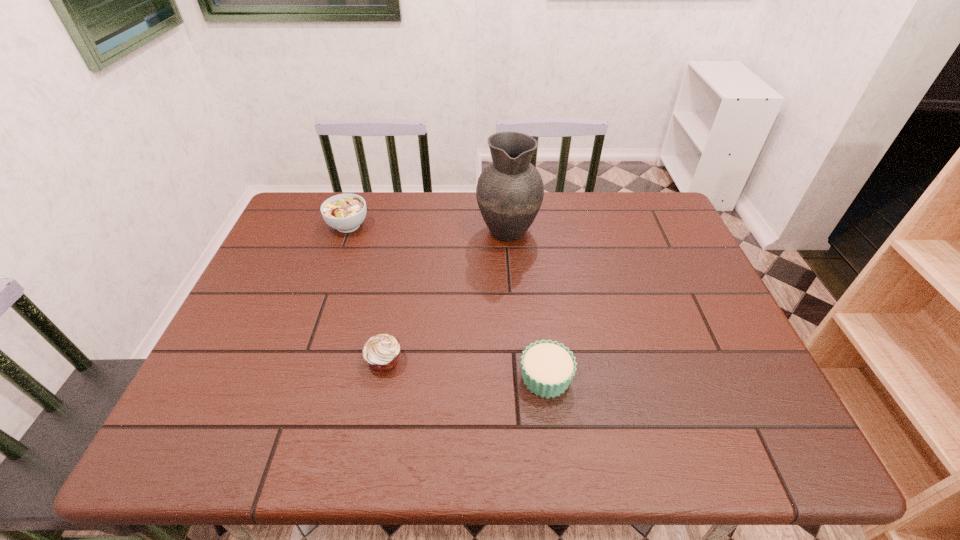
Image resolution: width=960 pixels, height=540 pixels. Find the location of `pitcher`. pitcher is located at coordinates (510, 191).

Find the location of a particular element. Image resolution: width=960 pixels, height=540 pixels. the leftmost object is located at coordinates (345, 212).

Find the location of `muffin`. muffin is located at coordinates (381, 352).

The width and height of the screenshot is (960, 540). What are the coordinates of `cupcake` in the screenshot? It's located at (548, 367).

In order to click on vacant position located on the side of the pitcher with the handle in this screenshot , I will do `click(505, 192)`.

Image resolution: width=960 pixels, height=540 pixels. I want to click on vacant region located on the front of the leftmost object, so pos(330,276).

Identify the location of vacant space located 0.060m on the right of the second object from left to right. 429,360.

Find the location of a particular element. This screenshot has width=960, height=540. blank area located on the back of the cupcake is located at coordinates (539, 316).

Where is `pitcher situated at the far edge`? This screenshot has width=960, height=540. pitcher situated at the far edge is located at coordinates (510, 191).

What are the coordinates of `soup bowl that is at the far edge` in the screenshot? It's located at (345, 212).